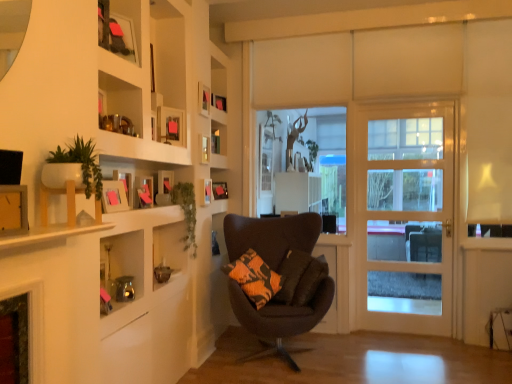
Question: Choose the correct answer: Is matte pink picture frame at upper left, which is the seventh picture frame in back-to-front order, inside matte black picture frame at upper center, acting as the 2th picture frame starting from the back, or outside it?

Choices:
 (A) outside
 (B) inside

Answer: (A)

Question: In terms of height, does matte pink picture frame at upper left, arranged as the second picture frame when viewed from the front, look taller or shorter compared to matte black picture frame at upper center, acting as the 2th picture frame starting from the back?

Choices:
 (A) tall
 (B) short

Answer: (A)

Question: Considering the real-world distances, which object is closest to the wooden picture frame at upper center, which is the 3th picture frame in back-to-front order?

Choices:
 (A) matte pink picture frame at upper left, which is the seventh picture frame in back-to-front order
 (B) matte wooden picture frame at upper center, placed as the fifth picture frame when sorted from back to front
 (C) matte wooden picture frame at upper center, the 6th picture frame viewed from the back
 (D) matte black picture frame at upper center, the 8th picture frame in the front-to-back sequence
 (E) matte wooden picture frame at upper center, the fifth picture frame from the front

Answer: (E)

Question: Estimate the real-world distances between objects in this image. Which object is farther from the matte wooden picture frame at upper center, the fifth picture frame from the front?

Choices:
 (A) dark brown fabric chair at center
 (B) orange-patterned fabric pillow at center
 (C) wooden picture frame at upper center, which is the 6th picture frame from front to back
 (D) light wood door at right
 (E) matte wooden picture frame at upper center, acting as the 3th picture frame starting from the front

Answer: (D)